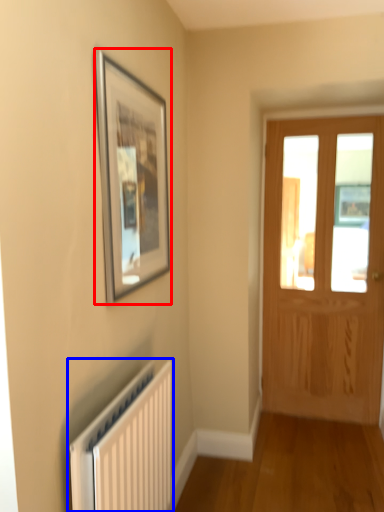
Question: Among these objects, which one is farthest to the camera, picture frame (highlighted by a red box) or radiator (highlighted by a blue box)?

Choices:
 (A) picture frame
 (B) radiator

Answer: (A)